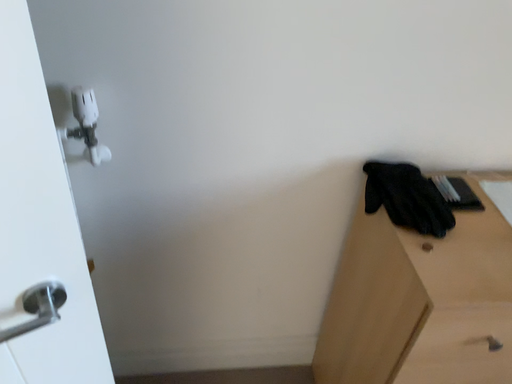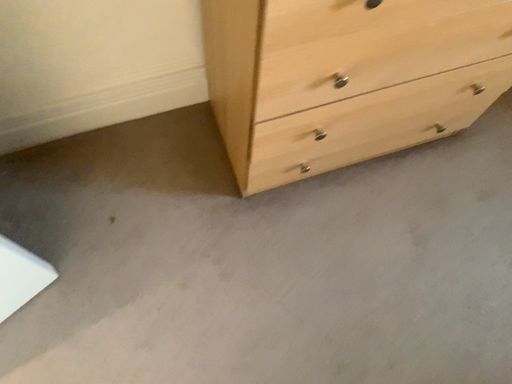
Question: How did the camera likely rotate when shooting the video?

Choices:
 (A) rotated right
 (B) rotated left

Answer: (A)